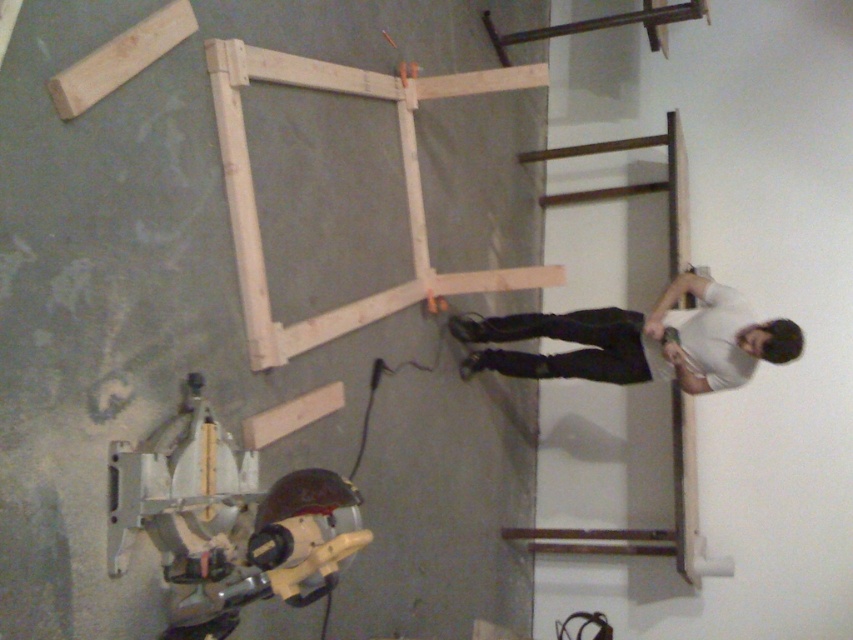
Is metallic yellow circular saw at lower left below white matte shirt at center?

Indeed, metallic yellow circular saw at lower left is positioned under white matte shirt at center.

Looking at this image, which of these two, metallic yellow circular saw at lower left or white matte shirt at center, stands taller?

Standing taller between the two is metallic yellow circular saw at lower left.

Between point (189, 632) and point (474, 333), which one is positioned behind?

The point (474, 333) is more distant.

Image resolution: width=853 pixels, height=640 pixels. Identify the location of metallic yellow circular saw at lower left. (225, 522).

This screenshot has height=640, width=853. Identify the location of white matte shirt at center. (639, 340).

Between point (784, 356) and point (625, 544), which one is positioned behind?

Positioned behind is point (625, 544).

Locate an element on the screen. The height and width of the screenshot is (640, 853). white matte shirt at center is located at coordinates (639, 340).

Is metallic yellow circular saw at lower left taller than brown wood window frame at right?

Incorrect, metallic yellow circular saw at lower left's height is not larger of brown wood window frame at right's.

Does metallic yellow circular saw at lower left lie in front of brown wood window frame at right?

Yes, it is.

The height and width of the screenshot is (640, 853). Find the location of `metallic yellow circular saw at lower left`. metallic yellow circular saw at lower left is located at coordinates (x=225, y=522).